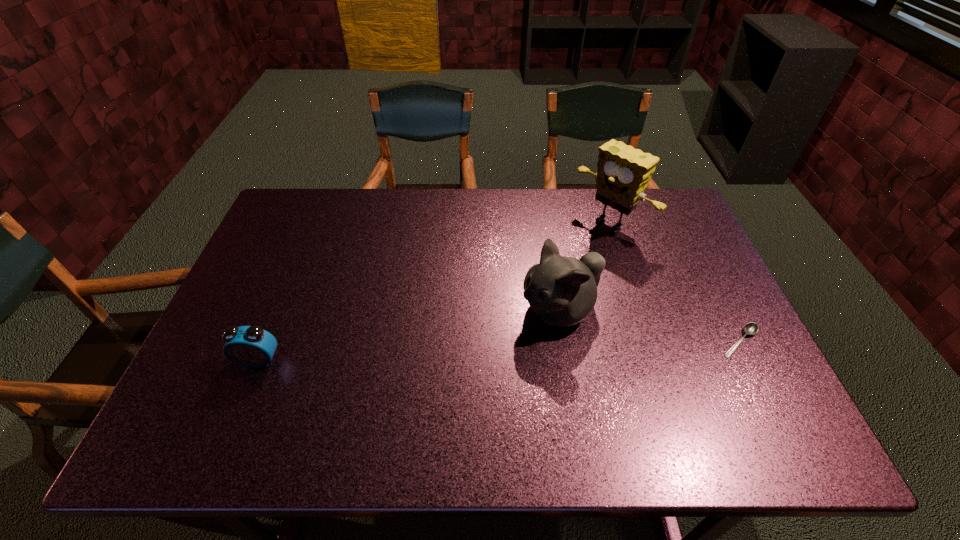
Image resolution: width=960 pixels, height=540 pixels. What are the coordinates of `the leftmost object` in the screenshot? It's located at (250, 346).

Locate an element on the screen. the second shortest object is located at coordinates (250, 346).

Locate an element on the screen. The width and height of the screenshot is (960, 540). the rightmost object is located at coordinates (751, 328).

In order to click on soupspoon in this screenshot , I will do pos(751,328).

At what (x,y) coordinates should I click in order to perform the action: click on the third shortest object. Please return your answer as a coordinate pair (x, y). The height and width of the screenshot is (540, 960). Looking at the image, I should click on (562, 291).

Where is `the tallest object`? The image size is (960, 540). the tallest object is located at coordinates (623, 173).

In order to click on the farthest object in this screenshot , I will do `click(623, 173)`.

At what (x,y) coordinates should I click in order to perform the action: click on free space located 0.060m on the face of the third tallest object. Please return your answer as a coordinate pair (x, y). Image resolution: width=960 pixels, height=540 pixels. Looking at the image, I should click on (246, 392).

This screenshot has height=540, width=960. What are the coordinates of `blank area located 0.240m on the back of the shortest object` in the screenshot? It's located at (700, 261).

Find the location of a particular element. vacant space situated on the face of the second tallest object is located at coordinates (437, 377).